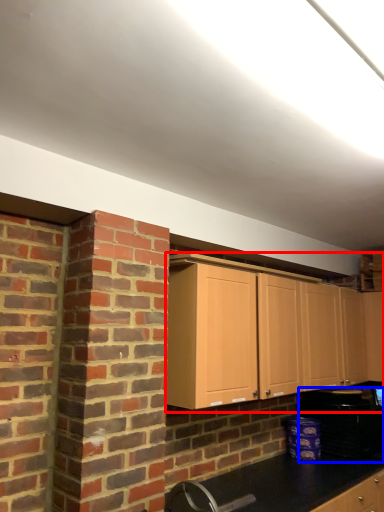
Question: Which object is closer to the camera taking this photo, cabinetry (highlighted by a red box) or appliance (highlighted by a blue box)?

Choices:
 (A) cabinetry
 (B) appliance

Answer: (A)